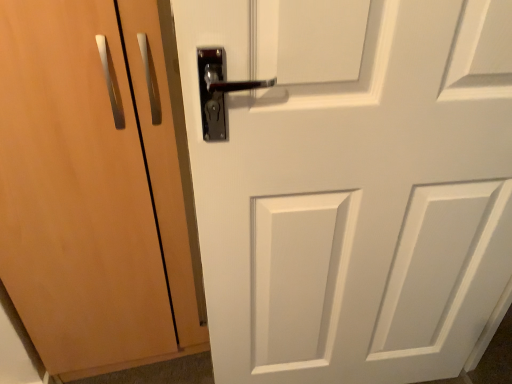
Where is `matte wood door at center, the 2th door positioned from the right`? matte wood door at center, the 2th door positioned from the right is located at coordinates (96, 186).

This screenshot has height=384, width=512. Describe the element at coordinates (96, 186) in the screenshot. I see `matte wood door at center, the 2th door positioned from the right` at that location.

Identify the location of white matte door at center, the 2th door positioned from the left. The width and height of the screenshot is (512, 384). (349, 183).

What do you see at coordinates (349, 183) in the screenshot? The image size is (512, 384). I see `white matte door at center, the first door from the right` at bounding box center [349, 183].

Image resolution: width=512 pixels, height=384 pixels. I want to click on matte wood door at center, the 2th door positioned from the right, so click(96, 186).

Considering the relative positions of matte wood door at center, arranged as the 1th door when viewed from the left, and white matte door at center, the first door from the right, in the image provided, is matte wood door at center, arranged as the 1th door when viewed from the left, to the right of white matte door at center, the first door from the right, from the viewer's perspective?

In fact, matte wood door at center, arranged as the 1th door when viewed from the left, is to the left of white matte door at center, the first door from the right.

Which is in front, matte wood door at center, arranged as the 1th door when viewed from the left, or white matte door at center, the first door from the right?

white matte door at center, the first door from the right, is in front.

In the scene shown: Which point is more forward, (x=70, y=134) or (x=502, y=157)?

The point (x=502, y=157) is in front.

From the image's perspective, which one is positioned higher, matte wood door at center, arranged as the 1th door when viewed from the left, or white matte door at center, the first door from the right?

matte wood door at center, arranged as the 1th door when viewed from the left.

Based on the photo, from a real-world perspective, is matte wood door at center, the 2th door positioned from the right, physically located above or below white matte door at center, the first door from the right?

From a real-world perspective, matte wood door at center, the 2th door positioned from the right, is physically below white matte door at center, the first door from the right.

In terms of width, does matte wood door at center, the 2th door positioned from the right, look wider or thinner when compared to white matte door at center, the 2th door positioned from the left?

Considering their sizes, matte wood door at center, the 2th door positioned from the right, looks broader than white matte door at center, the 2th door positioned from the left.

Considering the sizes of objects matte wood door at center, the 2th door positioned from the right, and white matte door at center, the 2th door positioned from the left, in the image provided, who is taller, matte wood door at center, the 2th door positioned from the right, or white matte door at center, the 2th door positioned from the left,?

white matte door at center, the 2th door positioned from the left.

Based on their sizes in the image, would you say matte wood door at center, the 2th door positioned from the right, is bigger or smaller than white matte door at center, the first door from the right?

A: Considering their sizes, matte wood door at center, the 2th door positioned from the right, takes up more space than white matte door at center, the first door from the right.

Would you say white matte door at center, the 2th door positioned from the left, is part of matte wood door at center, arranged as the 1th door when viewed from the left,'s contents?

No, white matte door at center, the 2th door positioned from the left, is not surrounded by matte wood door at center, arranged as the 1th door when viewed from the left.

Is matte wood door at center, the 2th door positioned from the right, placed right next to white matte door at center, the first door from the right?

matte wood door at center, the 2th door positioned from the right, and white matte door at center, the first door from the right, are clearly separated.

Could you tell me if matte wood door at center, the 2th door positioned from the right, is facing white matte door at center, the 2th door positioned from the left?

No, matte wood door at center, the 2th door positioned from the right, is not facing towards white matte door at center, the 2th door positioned from the left.

The height and width of the screenshot is (384, 512). In order to click on door on the left of white matte door at center, the 2th door positioned from the left in this screenshot , I will do `click(96, 186)`.

In the scene shown: Does white matte door at center, the first door from the right, appear on the right side of matte wood door at center, the 2th door positioned from the right?

Result: Correct, you'll find white matte door at center, the first door from the right, to the right of matte wood door at center, the 2th door positioned from the right.

Relative to matte wood door at center, the 2th door positioned from the right, is white matte door at center, the 2th door positioned from the left, in front or behind?

Clearly, white matte door at center, the 2th door positioned from the left, is in front of matte wood door at center, the 2th door positioned from the right.

Between point (466, 102) and point (136, 72), which one is positioned in front?

Point (466, 102)

From the image's perspective, is white matte door at center, the 2th door positioned from the left, above matte wood door at center, the 2th door positioned from the right?

Actually, white matte door at center, the 2th door positioned from the left, appears below matte wood door at center, the 2th door positioned from the right, in the image.

From a real-world perspective, does white matte door at center, the 2th door positioned from the left, sit lower than matte wood door at center, the 2th door positioned from the right?

Actually, white matte door at center, the 2th door positioned from the left, is physically above matte wood door at center, the 2th door positioned from the right, in the real world.

Based on the photo, is white matte door at center, the 2th door positioned from the left, wider or thinner than matte wood door at center, the 2th door positioned from the right?

In the image, white matte door at center, the 2th door positioned from the left, appears to be more narrow than matte wood door at center, the 2th door positioned from the right.

Does white matte door at center, the first door from the right, have a greater height compared to matte wood door at center, the 2th door positioned from the right?

Correct, white matte door at center, the first door from the right, is much taller as matte wood door at center, the 2th door positioned from the right.

Considering the sizes of objects white matte door at center, the 2th door positioned from the left, and matte wood door at center, the 2th door positioned from the right, in the image provided, who is smaller, white matte door at center, the 2th door positioned from the left, or matte wood door at center, the 2th door positioned from the right,?

white matte door at center, the 2th door positioned from the left, is smaller.

Does white matte door at center, the 2th door positioned from the left, contain matte wood door at center, arranged as the 1th door when viewed from the left?

No.

Is white matte door at center, the first door from the right, in contact with matte wood door at center, arranged as the 1th door when viewed from the left?

No, white matte door at center, the first door from the right, is not beside matte wood door at center, arranged as the 1th door when viewed from the left.

Is white matte door at center, the first door from the right, oriented towards matte wood door at center, arranged as the 1th door when viewed from the left?

No, white matte door at center, the first door from the right, is not oriented towards matte wood door at center, arranged as the 1th door when viewed from the left.

How many degrees apart are the facing directions of white matte door at center, the 2th door positioned from the left, and matte wood door at center, arranged as the 1th door when viewed from the left?

They differ by 5.55 degrees in their facing directions.

Identify the location of door lying below the matte wood door at center, arranged as the 1th door when viewed from the left (from the image's perspective). The width and height of the screenshot is (512, 384). (349, 183).

Where is `door that is on the right side of matte wood door at center, the 2th door positioned from the right`? Image resolution: width=512 pixels, height=384 pixels. door that is on the right side of matte wood door at center, the 2th door positioned from the right is located at coordinates (349, 183).

Locate an element on the screen. The width and height of the screenshot is (512, 384). door that is on the left side of white matte door at center, the 2th door positioned from the left is located at coordinates (96, 186).